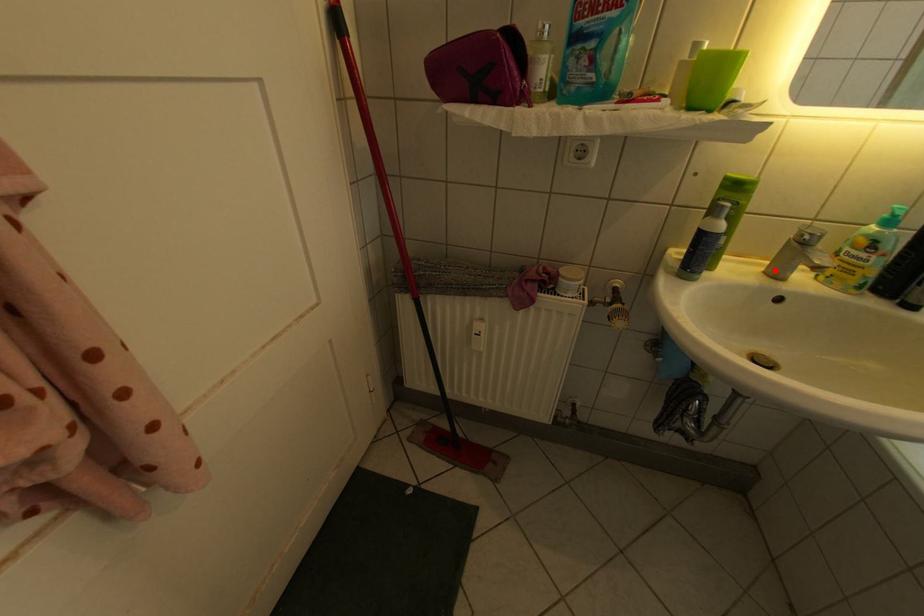
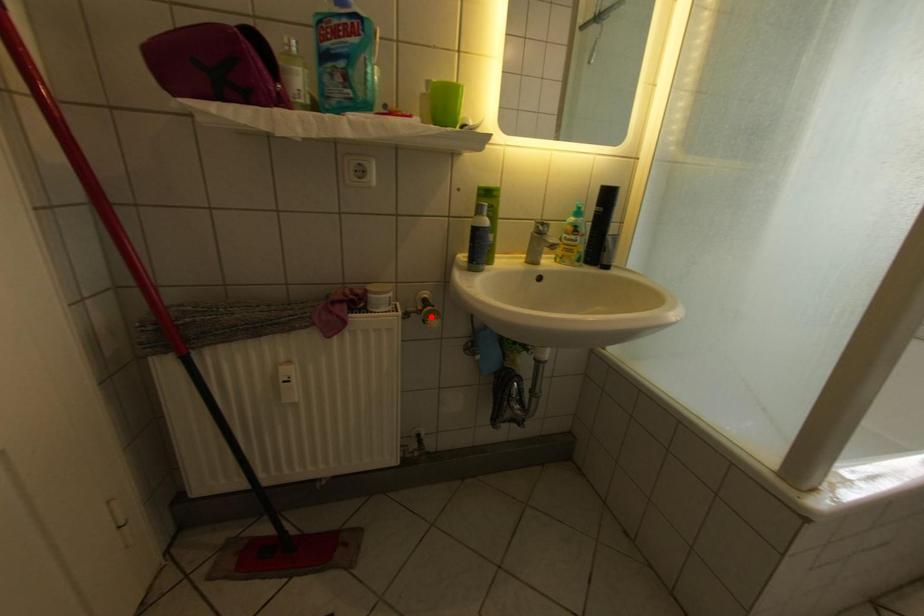
I am providing you with two images of the same scene from different viewpoints. A red point is marked on the first image and another point is marked on the second image. Does the point marked in image1 correspond to the same location as the one in image2?

No